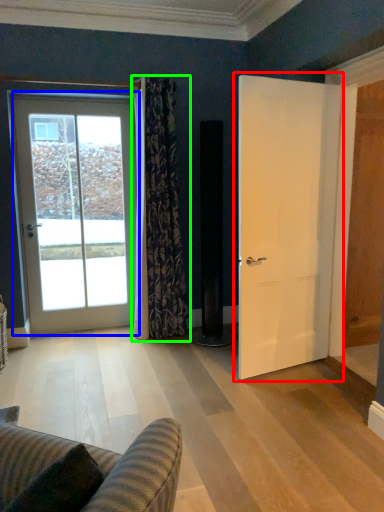
Question: Which object is the closest to the door (highlighted by a red box)? Choose among these: door (highlighted by a blue box) or curtain (highlighted by a green box).

Choices:
 (A) door
 (B) curtain

Answer: (B)